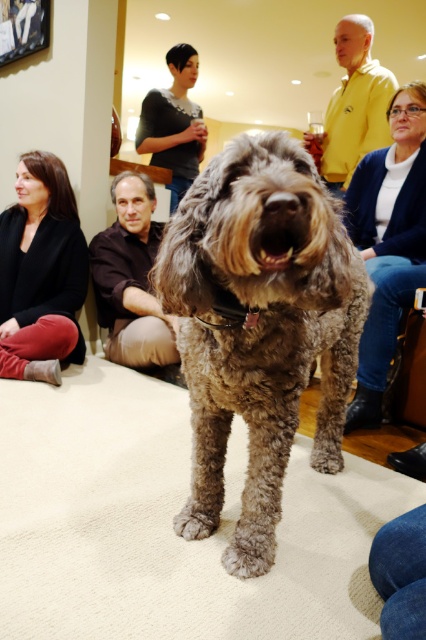
You are standing at the center of the room and want to take a photo of the fuzzy brown dog at center. Where should you point your camera?

You should point your camera towards the center of the room where the fuzzy brown dog at center is located at point coordinates (259, 326).

You are a person who just arrived at the scene and wants to put your jacket on the floor near the dog. Which jacket, the denim jacket at lower right or the brown leather jacket at lower center, has more space around it for you to place your jacket?

The denim jacket at lower right has more space around it because it is bigger than the brown leather jacket at lower center.

You are a person who is 1.8 meters tall standing in the scene. You want to pick up the denim jacket at lower right and the brown leather jacket at lower center. Which jacket will you have to bend down more to pick up?

The denim jacket at lower right is much taller than the brown leather jacket at lower center. Since the denim jacket is taller, you would need to bend down less to pick it up compared to the shorter brown leather jacket. Therefore, you will have to bend down more to pick up the brown leather jacket at lower center.